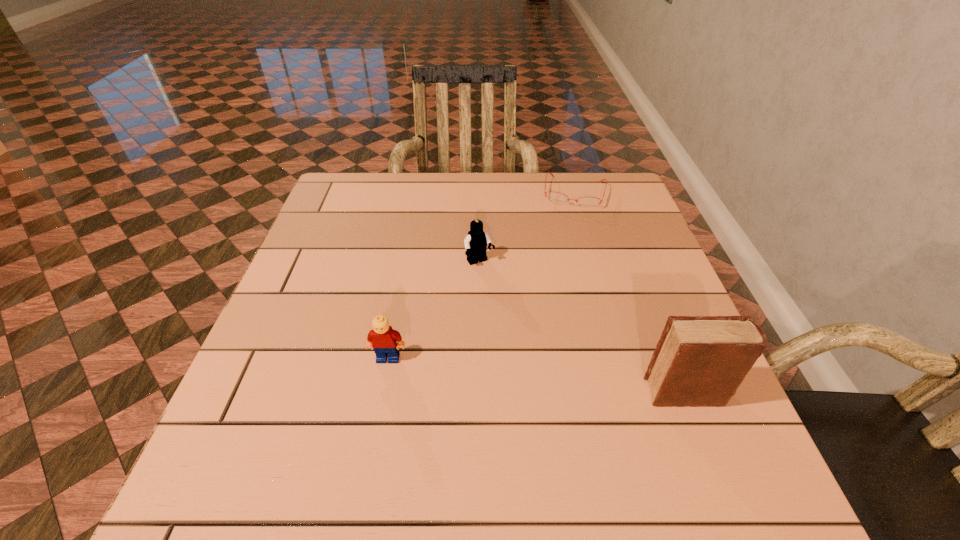
The image size is (960, 540). I want to click on vacant space on the desktop that is between the leftmost object and the tallest object and is positioned on the front-facing side of the right Lego, so click(556, 377).

The height and width of the screenshot is (540, 960). What are the coordinates of `free spot on the desktop that is between the nearer Lego and the tallest object and is positioned on the lenses of the farthest object` in the screenshot? It's located at (542, 376).